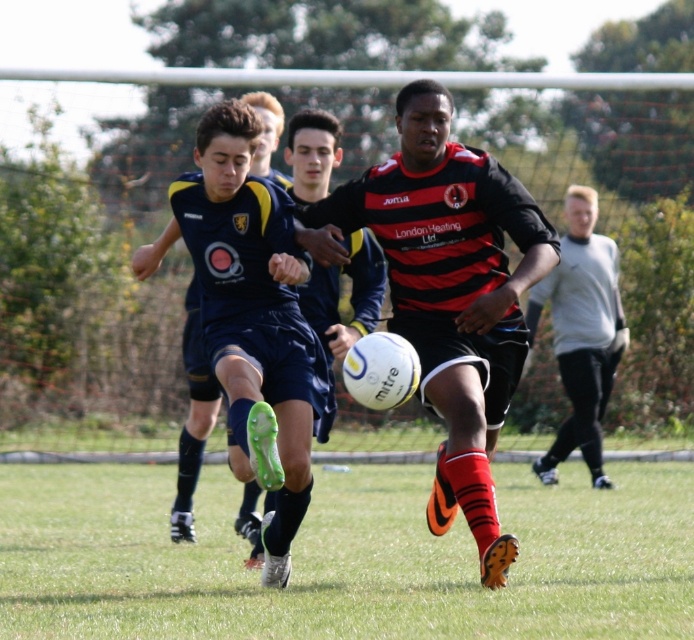
Does point (398, 472) come farther from viewer compared to point (251, 400)?

Yes, it is behind point (251, 400).

Can you confirm if green grass at center is positioned to the left of dark blue jersey at center?

Correct, you'll find green grass at center to the left of dark blue jersey at center.

Who is more forward, (x=237, y=573) or (x=242, y=237)?

Point (x=242, y=237) is in front.

In order to click on green grass at center in this screenshot , I will do `click(344, 556)`.

Does point (403, 160) come farther from viewer compared to point (595, 400)?

No.

Identify the location of black matte soccer ball at center. This screenshot has width=694, height=640. (448, 292).

Measure the distance between green grass at center and light gray fleece at right.

They are 18.34 feet apart.

The width and height of the screenshot is (694, 640). In order to click on green grass at center in this screenshot , I will do `click(344, 556)`.